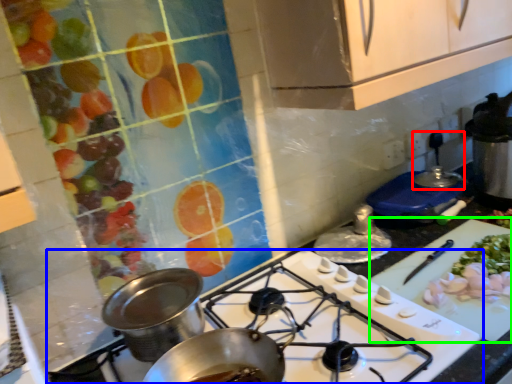
Question: Based on their relative distances, which object is nearer to kitchen appliance (highlighted by a red box)? Choose from gas stove (highlighted by a blue box) and cutting board (highlighted by a green box).

Choices:
 (A) gas stove
 (B) cutting board

Answer: (B)